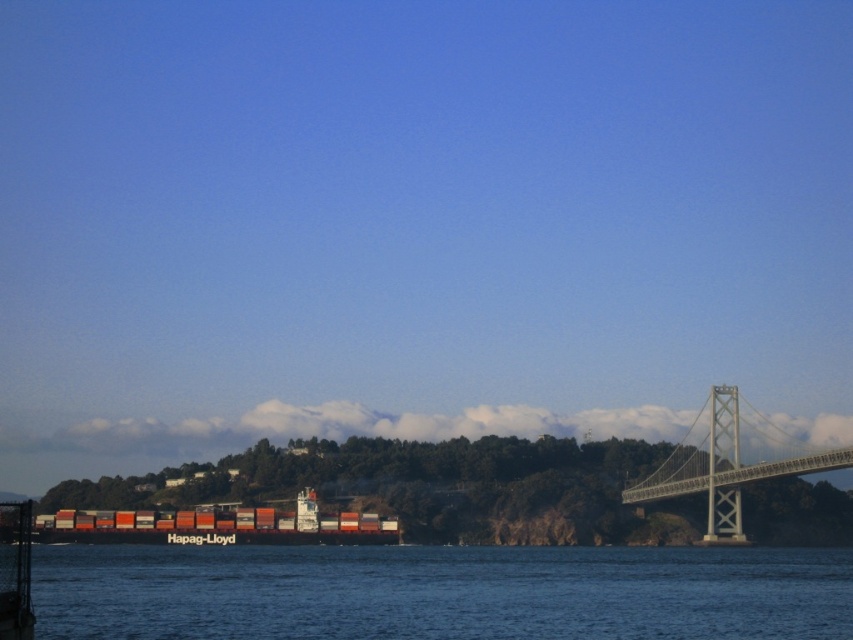
Is blue water at lower center positioned before orange matte container ship at center?

Yes.

Between blue water at lower center and orange matte container ship at center, which one has more height?

blue water at lower center is taller.

Which is behind, point (238, 627) or point (163, 512)?

The point (163, 512) is more distant.

Locate an element on the screen. blue water at lower center is located at coordinates (439, 593).

Can you confirm if gray metallic bridge at right is bigger than orange matte container ship at center?

Incorrect, gray metallic bridge at right is not larger than orange matte container ship at center.

How much distance is there between gray metallic bridge at right and orange matte container ship at center?

gray metallic bridge at right is 92.74 meters away from orange matte container ship at center.

Is point (675, 465) less distant than point (280, 522)?

No, (675, 465) is behind (280, 522).

Where is `gray metallic bridge at right`? This screenshot has width=853, height=640. gray metallic bridge at right is located at coordinates (730, 461).

Can you confirm if blue water at lower center is positioned above gray metallic bridge at right?

No.

Between blue water at lower center and gray metallic bridge at right, which one has more height?

blue water at lower center

Does point (601, 576) come closer to viewer compared to point (720, 492)?

Yes, point (601, 576) is in front of point (720, 492).

Identify the location of blue water at lower center. This screenshot has height=640, width=853. 439,593.